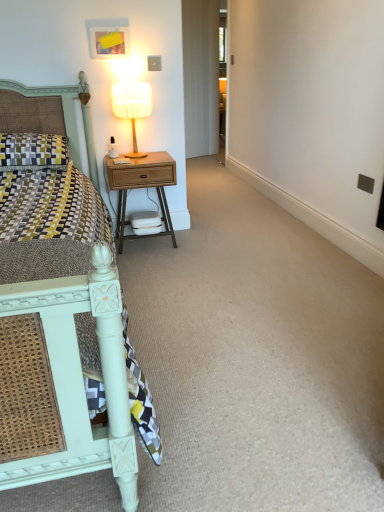
Find the location of a particular element. vacant area to the right of woodenmaterial/texturenightstand at left is located at coordinates (207, 241).